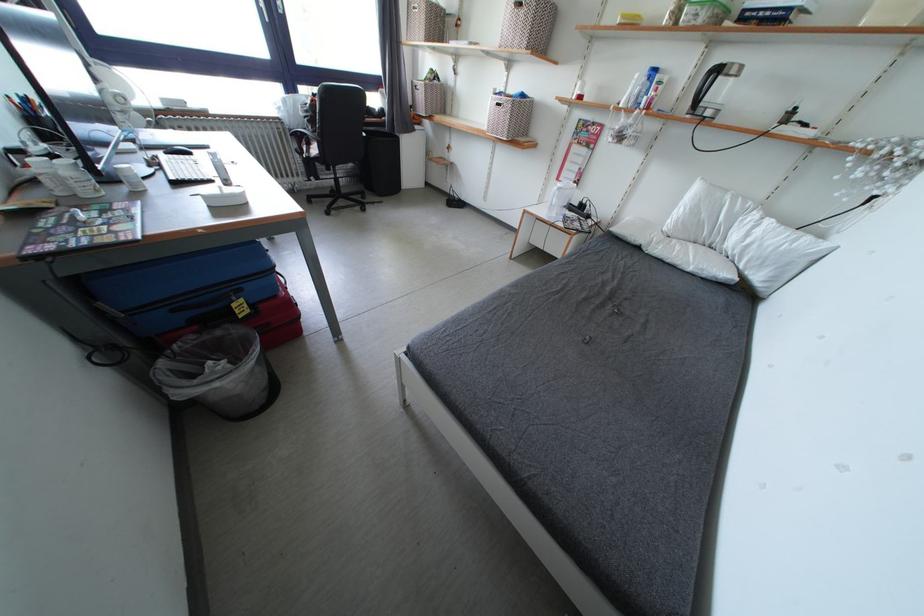
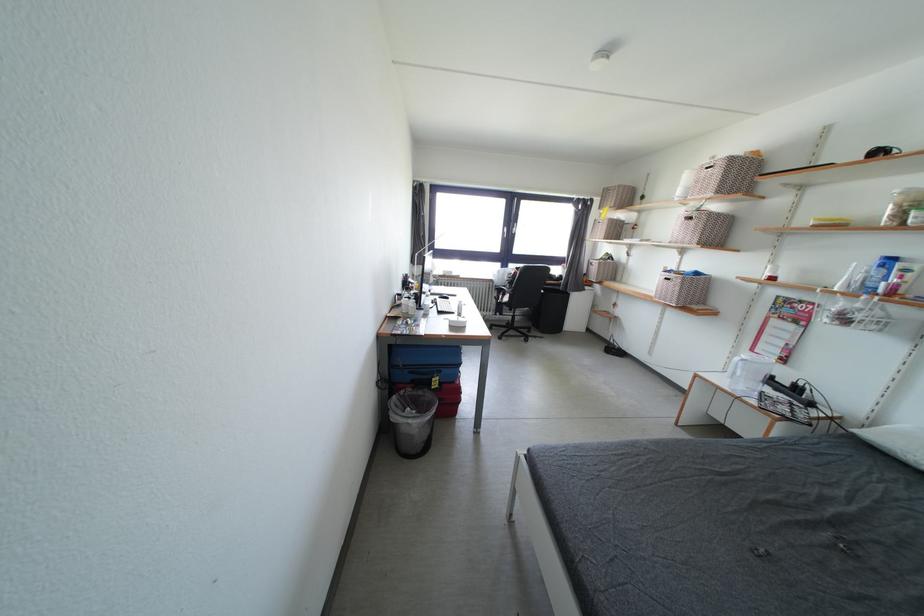
Locate, in the second image, the point that corresponds to [240,310] in the first image.

(440, 384)